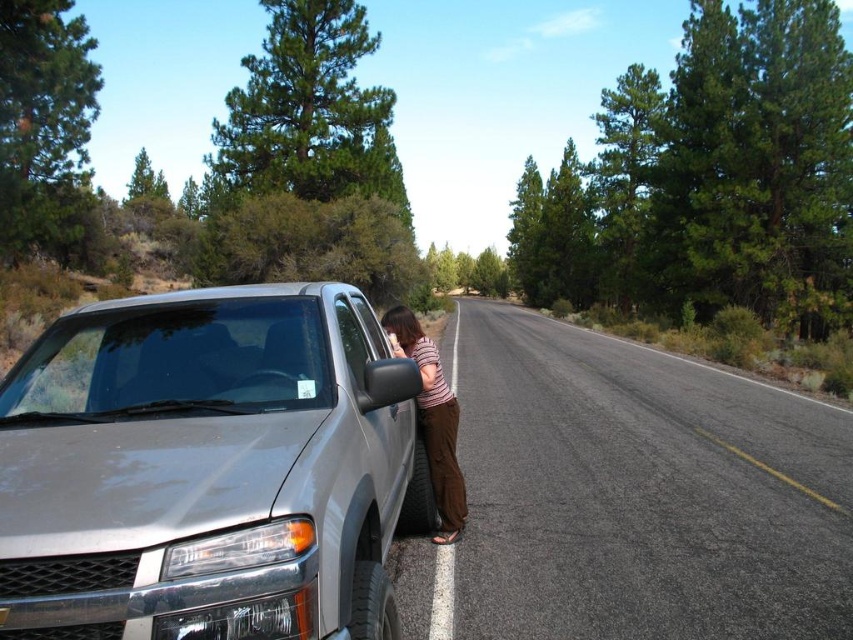
You are standing at point (396, 316) and want to walk to the silver pickup truck parked on the left side of the road. Is the point (312, 349) between you and the truck?

Yes, point (312, 349) is between you and the silver pickup truck parked on the left side of the road because it is in front of point (396, 316) where you are standing.

You are standing at the camera position and want to throw a rock to hit the transparent glass windshield at center. If your maximum throwing distance is 8 feet, will you be able to reach it?

The transparent glass windshield at center is 8.59 feet from the camera, which is beyond your maximum throwing distance of 8 feet. Therefore, you won cannot reach it.